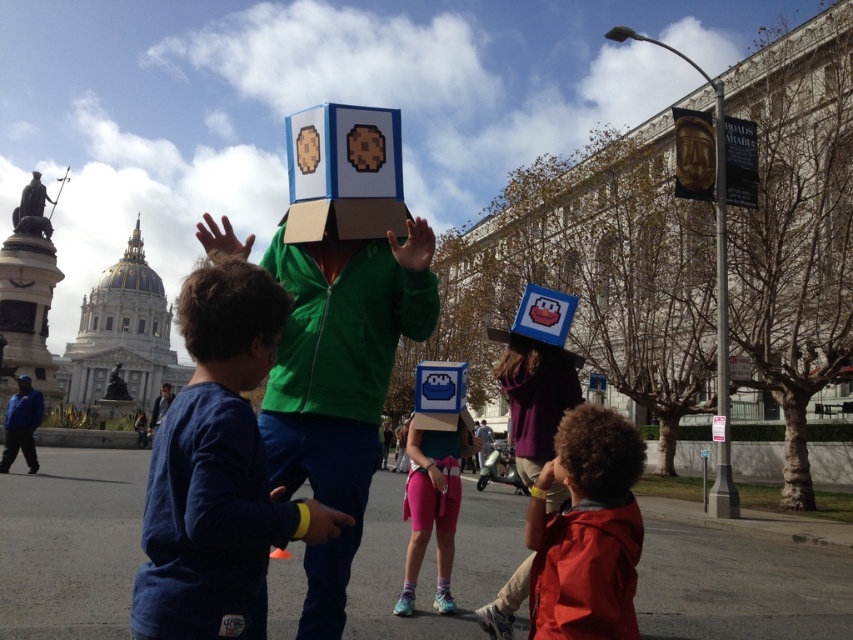
Is matte red jacket at lower right taller than matte green jacket at center?

No, matte red jacket at lower right is not taller than matte green jacket at center.

Is point (637, 444) more distant than point (283, 314)?

Yes, point (637, 444) is behind point (283, 314).

Is point (625, 568) more distant than point (254, 346)?

No, it is in front of (254, 346).

I want to click on matte red jacket at lower right, so click(x=585, y=531).

Is the position of matte red jacket at lower right more distant than that of matte blue helmet at center?

No, matte red jacket at lower right is in front of matte blue helmet at center.

Does point (613, 512) come in front of point (22, 392)?

Yes, point (613, 512) is closer to viewer.

Is point (584, 592) positioned before point (27, 388)?

Yes, point (584, 592) is closer to viewer.

This screenshot has height=640, width=853. What are the coordinates of `matte red jacket at lower right` in the screenshot? It's located at (585, 531).

Is point (581, 412) positioned after point (16, 378)?

No.

Does curly brown hair at lower right appear on the left side of matte blue helmet at center?

No, curly brown hair at lower right is not to the left of matte blue helmet at center.

Image resolution: width=853 pixels, height=640 pixels. In order to click on curly brown hair at lower right in this screenshot , I will do `click(596, 454)`.